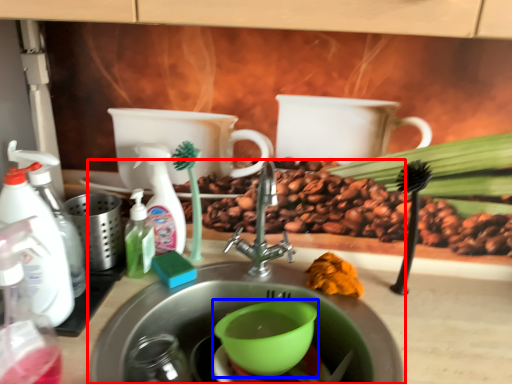
Question: Which object appears farthest to the camera in this image, sink (highlighted by a red box) or mixing bowl (highlighted by a blue box)?

Choices:
 (A) sink
 (B) mixing bowl

Answer: (B)